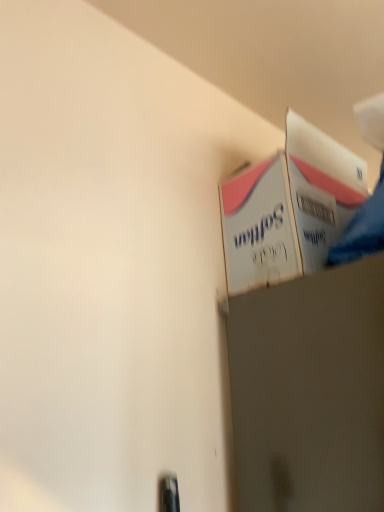
This screenshot has width=384, height=512. What do you see at coordinates (289, 208) in the screenshot?
I see `white cardboard box at upper right` at bounding box center [289, 208].

I want to click on white cardboard box at upper right, so coord(289,208).

Locate an element on the screen. white cardboard box at upper right is located at coordinates (289, 208).